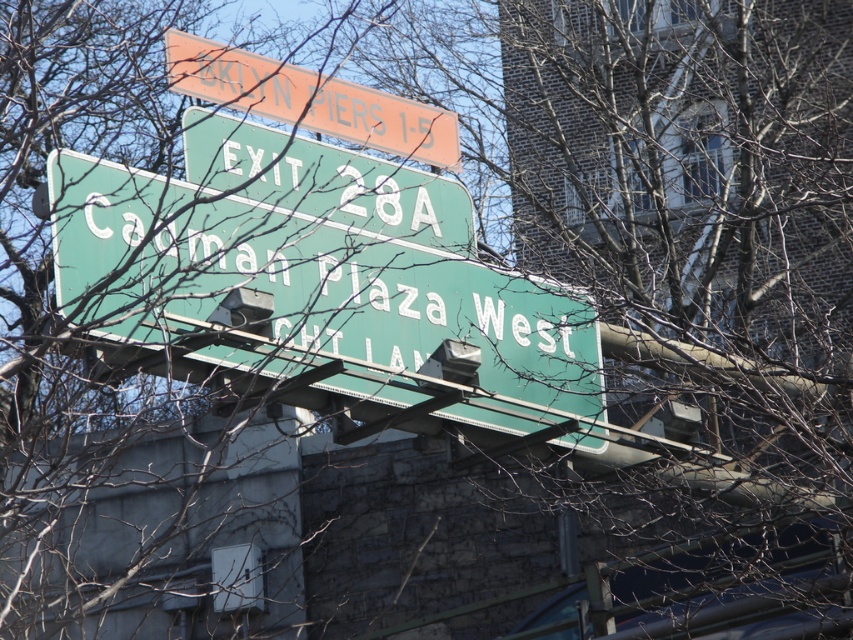
Is green metallic sign at center positioned in front of orange plastic sign at upper center?

Yes, it is.

Does point (561, 348) come farther from viewer compared to point (300, 120)?

Yes, point (561, 348) is farther from viewer.

Identify the location of green metallic sign at center. (x=318, y=300).